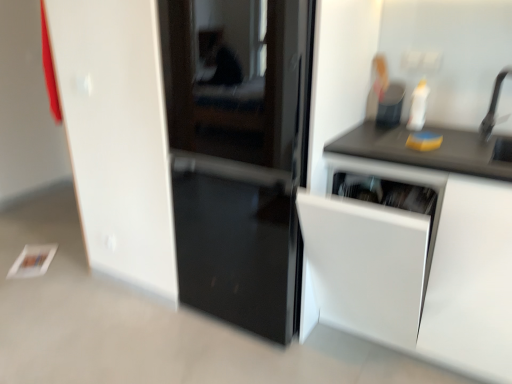
The image size is (512, 384). Find the location of `vacant region below black matte faucet at upper right (from a real-world perspective)`. vacant region below black matte faucet at upper right (from a real-world perspective) is located at coordinates (499, 135).